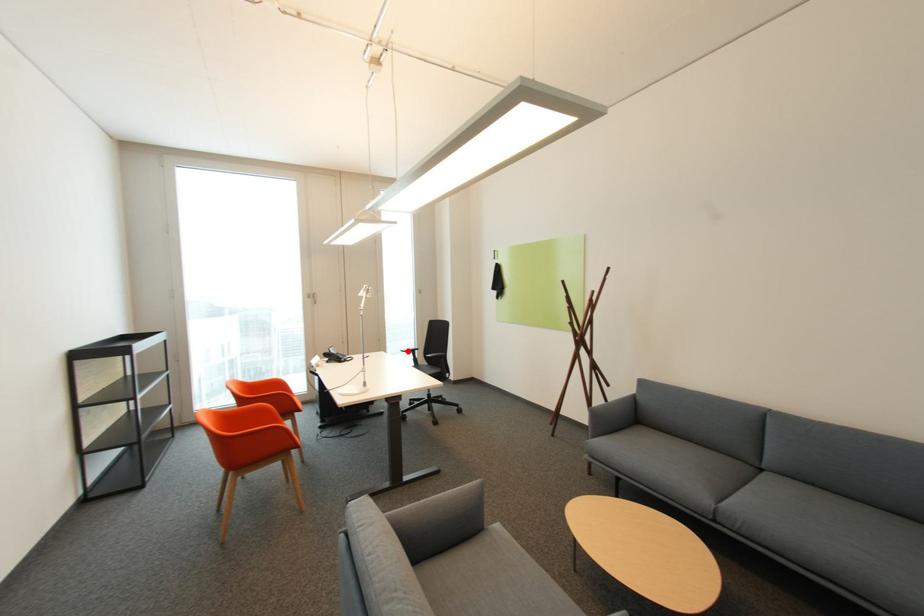
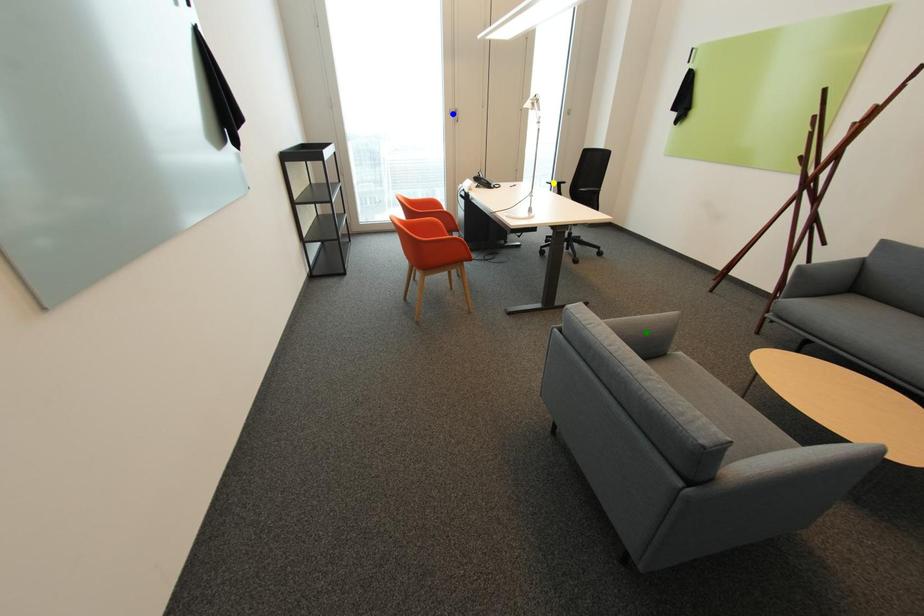
Question: I am providing you with two images of the same scene from different viewpoints. A red point is marked on the first image. You are given multiple points on the second image. Can you choose the point in image 2 that corresponds to the point in image 1?

Choices:
 (A) blue point
 (B) yellow point
 (C) green point

Answer: (B)